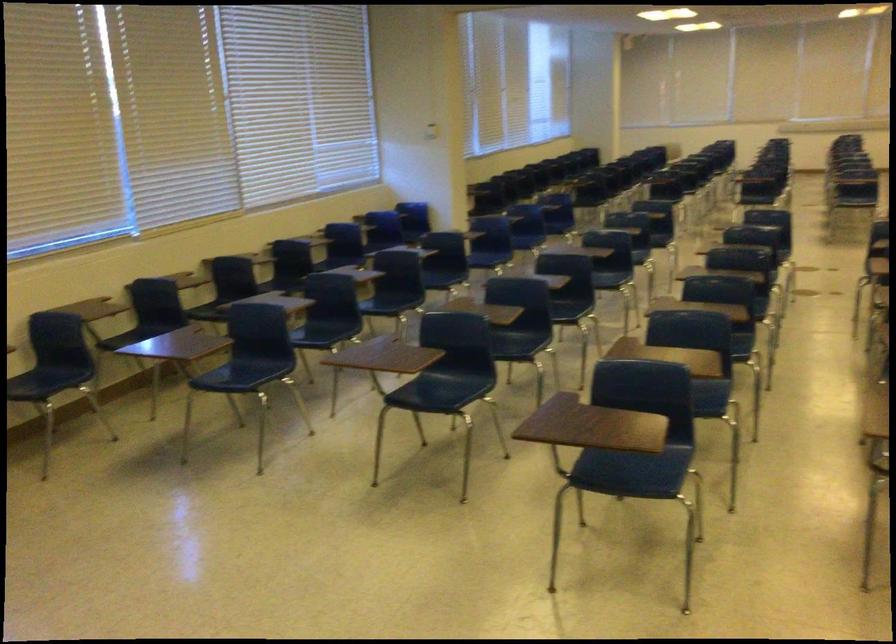
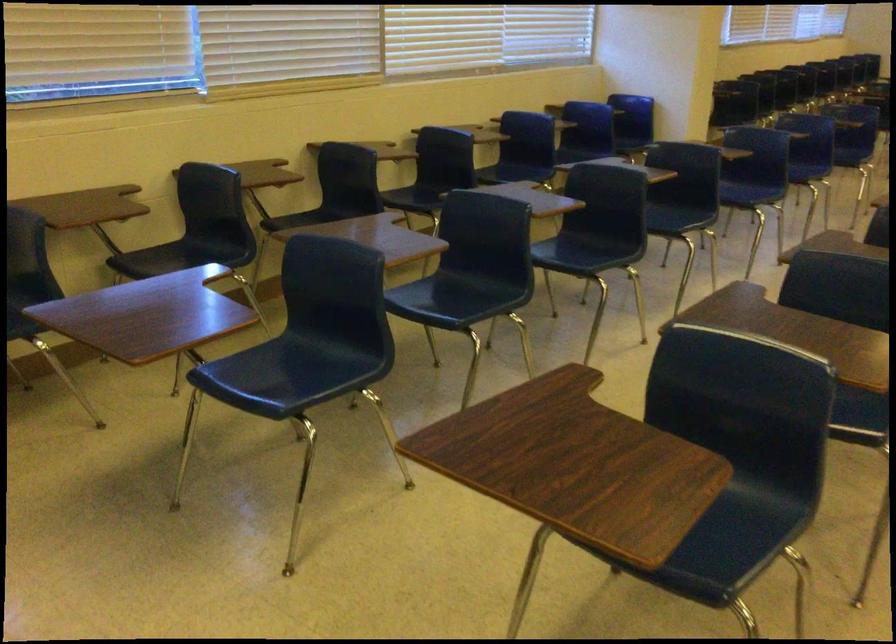
Where in the second image is the point corresponding to point 392,304 from the first image?

(586, 252)